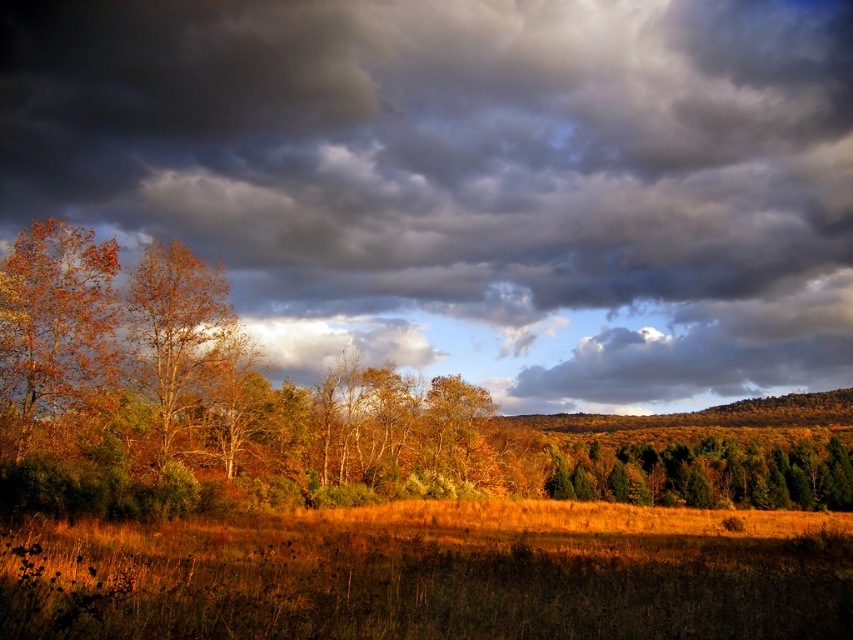
Who is higher up, green matte trees at center or orange matte tree at left?

orange matte tree at left is higher up.

The image size is (853, 640). Identify the location of green matte trees at center. (711, 474).

Can you confirm if autumn foliage at center is positioned above green matte trees at center?

Indeed, autumn foliage at center is positioned over green matte trees at center.

Image resolution: width=853 pixels, height=640 pixels. What are the coordinates of `autumn foliage at center` in the screenshot? It's located at (283, 412).

Locate an element on the screen. This screenshot has width=853, height=640. autumn foliage at center is located at coordinates (283, 412).

Is autumn foliage at center below golden grass at lower center?

Yes.

Who is more distant from viewer, (28, 298) or (683, 608)?

Positioned behind is point (28, 298).

Which is behind, point (83, 502) or point (296, 630)?

The point (83, 502) is behind.

Locate an element on the screen. autumn foliage at center is located at coordinates (283, 412).